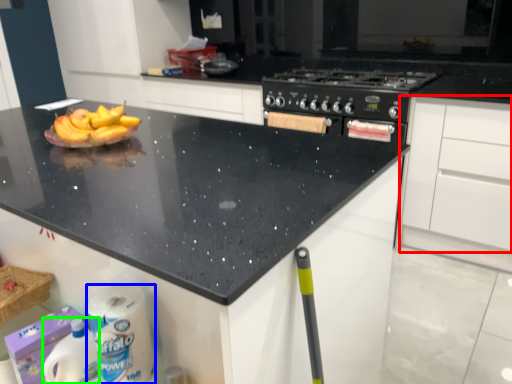
Question: Which object is positioned closest to cabinetry (highlighted by a red box)? Select from toilet paper (highlighted by a blue box) and cleaning product (highlighted by a green box).

Choices:
 (A) toilet paper
 (B) cleaning product

Answer: (A)